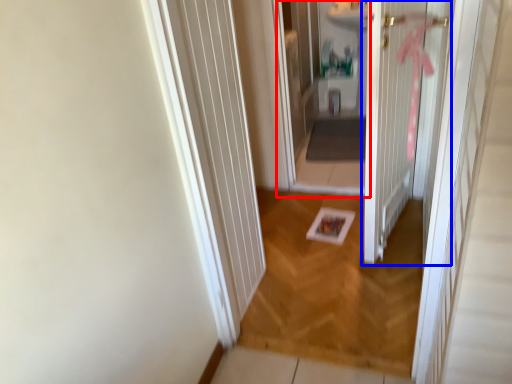
Question: Among these objects, which one is farthest to the camera, corridor (highlighted by a red box) or door (highlighted by a blue box)?

Choices:
 (A) corridor
 (B) door

Answer: (A)